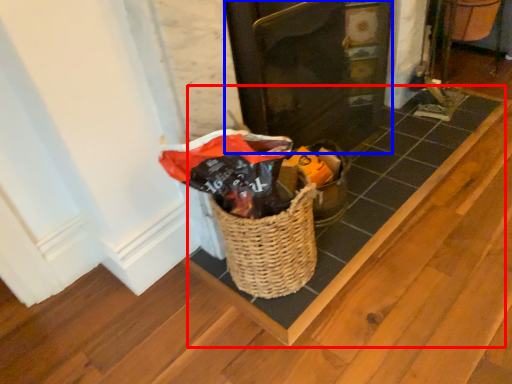
Question: Among these objects, which one is nearest to the camera, plank (highlighted by a red box) or door (highlighted by a blue box)?

Choices:
 (A) plank
 (B) door

Answer: (B)